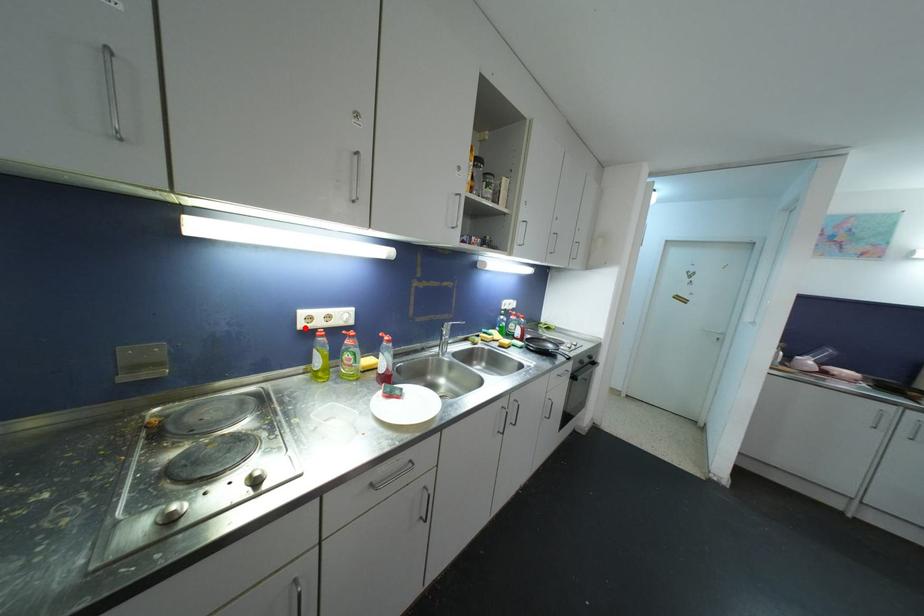
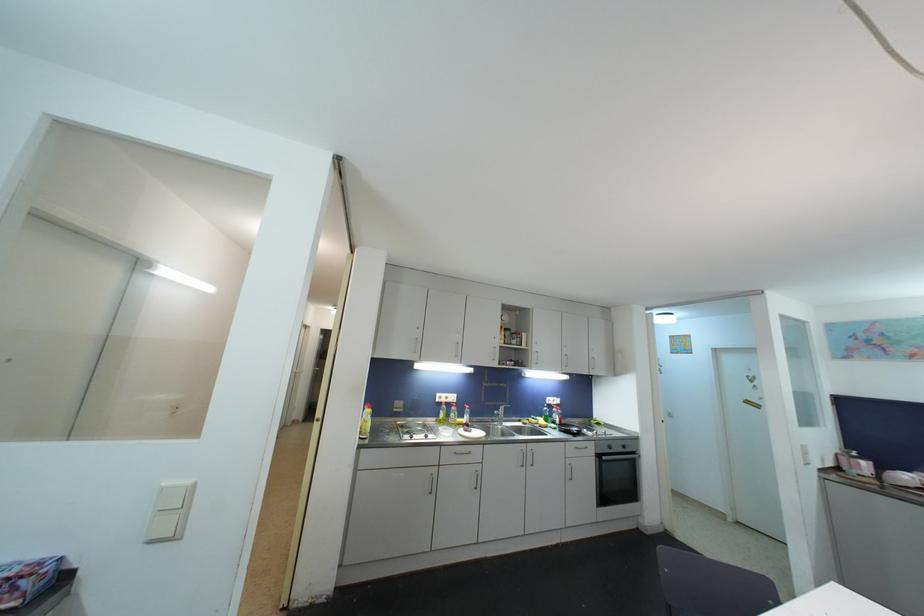
Find the pixel in the second image that matches the highlighted location in the first image.

(441, 403)